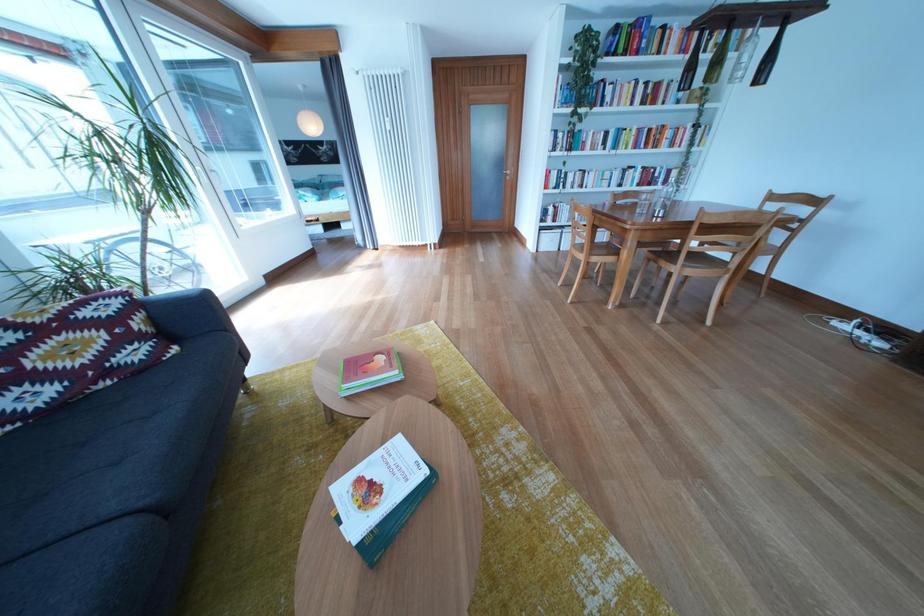
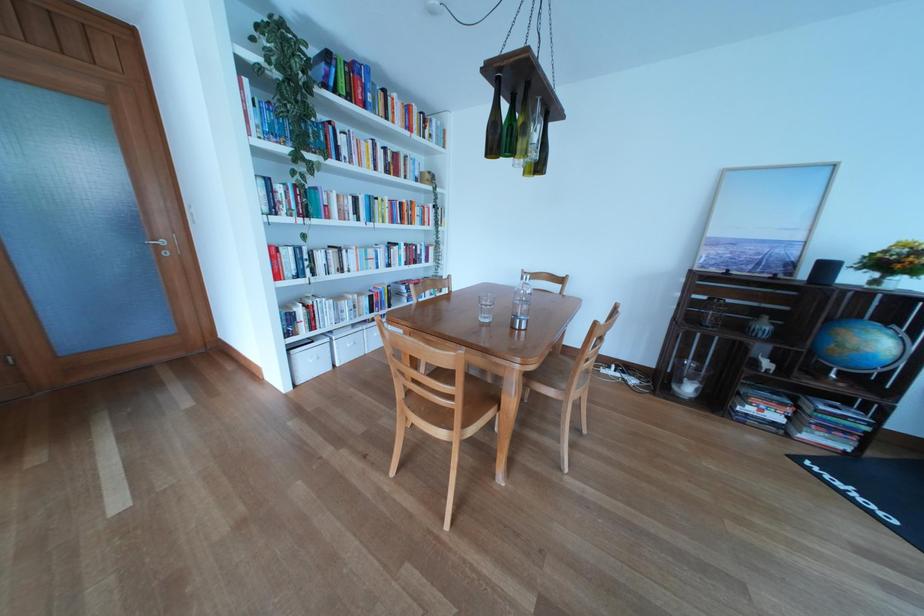
The point at (619, 139) is marked in the first image. Where is the corresponding point in the second image?

(369, 206)